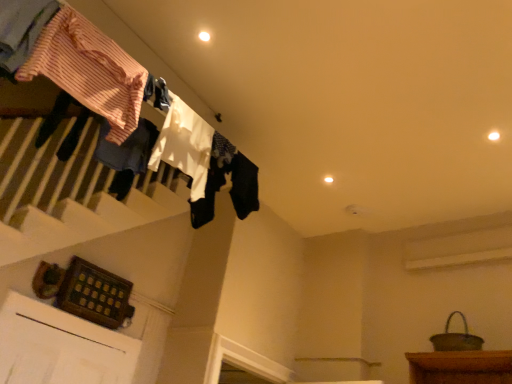
Question: From the image's perspective, is striped cotton shirt at upper left, the third clothing in the back-to-front sequence, located beneath white cotton socks at upper center, which is the 1th clothing in back-to-front order?

Choices:
 (A) no
 (B) yes

Answer: (A)

Question: Is striped cotton shirt at upper left, the third clothing in the back-to-front sequence, at the right side of white cotton socks at upper center, which is the 1th clothing in back-to-front order?

Choices:
 (A) no
 (B) yes

Answer: (A)

Question: Considering the relative positions of striped cotton shirt at upper left, arranged as the 2th clothing when viewed from the front, and white cotton socks at upper center, which is the 1th clothing in back-to-front order, in the image provided, is striped cotton shirt at upper left, arranged as the 2th clothing when viewed from the front, to the left of white cotton socks at upper center, which is the 1th clothing in back-to-front order, from the viewer's perspective?

Choices:
 (A) yes
 (B) no

Answer: (A)

Question: Does striped cotton shirt at upper left, the third clothing in the back-to-front sequence, have a greater width compared to white cotton socks at upper center, arranged as the fourth clothing when viewed from the front?

Choices:
 (A) yes
 (B) no

Answer: (A)

Question: Is striped cotton shirt at upper left, the third clothing in the back-to-front sequence, positioned far away from white cotton socks at upper center, arranged as the fourth clothing when viewed from the front?

Choices:
 (A) no
 (B) yes

Answer: (A)

Question: Looking at the image, does white fabric at upper center, which is the 2th clothing from back to front, seem bigger or smaller compared to striped cotton shirt at upper left, the third clothing in the back-to-front sequence?

Choices:
 (A) small
 (B) big

Answer: (A)

Question: Considering the positions of point (176, 117) and point (116, 61), is point (176, 117) closer or farther from the camera than point (116, 61)?

Choices:
 (A) farther
 (B) closer

Answer: (A)

Question: Considering the relative positions of white fabric at upper center, the 3th clothing in the front-to-back sequence, and striped cotton shirt at upper left, the third clothing in the back-to-front sequence, in the image provided, is white fabric at upper center, the 3th clothing in the front-to-back sequence, to the left or to the right of striped cotton shirt at upper left, the third clothing in the back-to-front sequence,?

Choices:
 (A) left
 (B) right

Answer: (B)

Question: From a real-world perspective, is white fabric at upper center, the 3th clothing in the front-to-back sequence, positioned above or below striped cotton shirt at upper left, the third clothing in the back-to-front sequence?

Choices:
 (A) above
 (B) below

Answer: (A)

Question: From their relative heights in the image, would you say white cotton socks at upper center, which is the 1th clothing in back-to-front order, is taller or shorter than striped cotton shirt at upper left, marked as the 4th clothing in a back-to-front arrangement?

Choices:
 (A) tall
 (B) short

Answer: (B)

Question: From a real-world perspective, is white cotton socks at upper center, arranged as the fourth clothing when viewed from the front, positioned above or below striped cotton shirt at upper left, positioned as the 1th clothing in front-to-back order?

Choices:
 (A) below
 (B) above

Answer: (B)

Question: In terms of width, does white cotton socks at upper center, which is the 1th clothing in back-to-front order, look wider or thinner when compared to striped cotton shirt at upper left, marked as the 4th clothing in a back-to-front arrangement?

Choices:
 (A) wide
 (B) thin

Answer: (B)

Question: From the image's perspective, is white cotton socks at upper center, which is the 1th clothing in back-to-front order, above or below striped cotton shirt at upper left, marked as the 4th clothing in a back-to-front arrangement?

Choices:
 (A) below
 (B) above

Answer: (A)

Question: From a real-world perspective, relative to white cotton socks at upper center, arranged as the fourth clothing when viewed from the front, is striped cotton shirt at upper left, positioned as the 1th clothing in front-to-back order, vertically above or below?

Choices:
 (A) below
 (B) above

Answer: (A)

Question: Based on their positions, is striped cotton shirt at upper left, marked as the 4th clothing in a back-to-front arrangement, located to the left or right of white cotton socks at upper center, arranged as the fourth clothing when viewed from the front?

Choices:
 (A) right
 (B) left

Answer: (B)